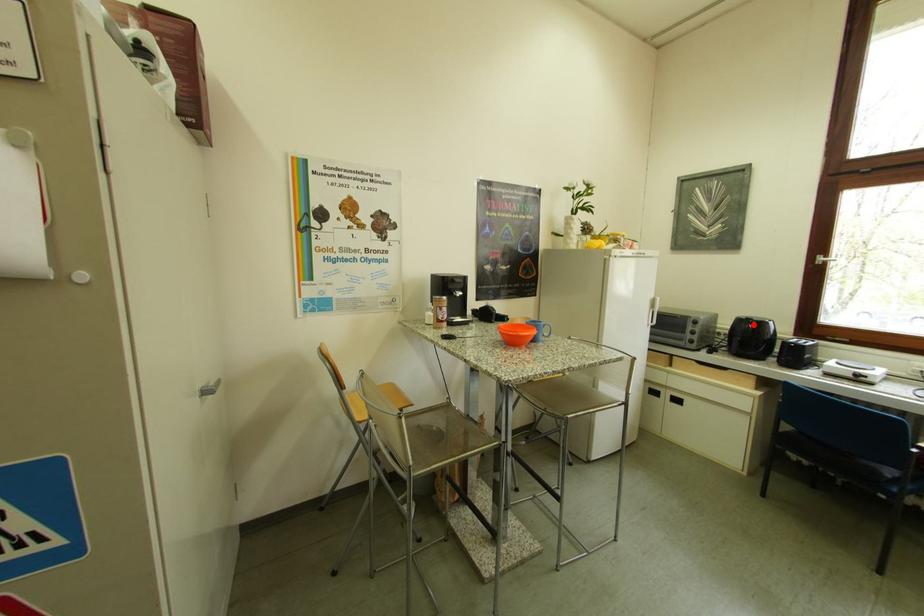
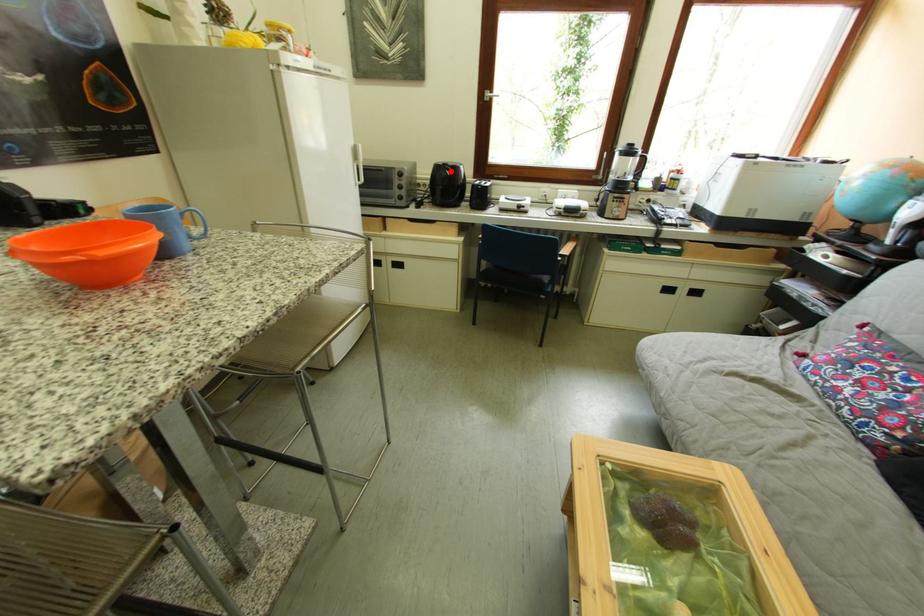
I am providing you with two images of the same scene from different viewpoints. A red point is marked on the first image and another point is marked on the second image. Is the red point in image1 aligned with the point shown in image2?

Yes